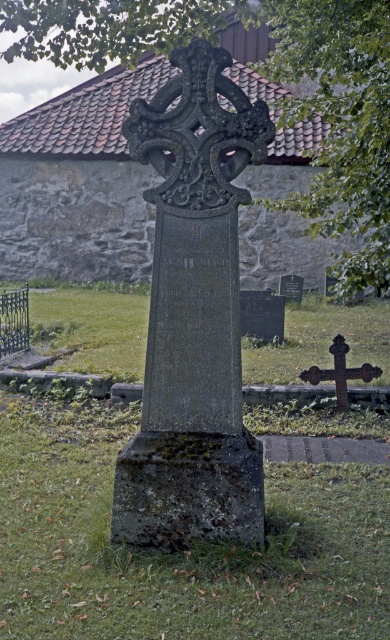
You are standing in a cemetery and want to take a photo of the green leafy tree at upper center and the rusty metal cross at lower right. Which object should you focus on first if you want both to be in clear focus?

The green leafy tree at upper center is closer to the viewer than the rusty metal cross at lower right, so you should focus on the green leafy tree at upper center first to ensure both are in clear focus.

You are standing at the Celtic cross monument and want to walk towards the point marked at coordinates point (288, 205). However, there is an obstacle at point (377, 371). Will you encounter this obstacle before reaching your destination?

Point (288, 205) is behind point (377, 371), so you will encounter the obstacle at point (377, 371) before reaching your destination.